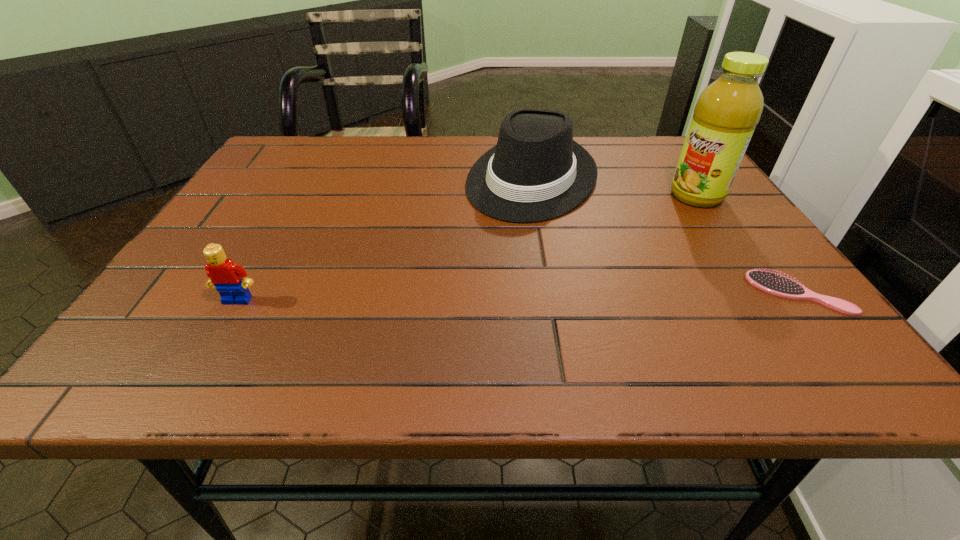
Locate an element on the screen. free space between the Lego and the tallest object is located at coordinates (468, 248).

The height and width of the screenshot is (540, 960). I want to click on empty space that is in between the shortest object and the leftmost object, so click(518, 296).

Where is `vacant area that lies between the tallest object and the hairbrush`? vacant area that lies between the tallest object and the hairbrush is located at coordinates (748, 244).

Where is `vacant point located between the third shortest object and the second shortest object`? vacant point located between the third shortest object and the second shortest object is located at coordinates (385, 239).

Locate an element on the screen. Image resolution: width=960 pixels, height=540 pixels. free space between the Lego and the fruit juice is located at coordinates (468, 248).

Find the location of a particular element. This screenshot has width=960, height=540. free space between the shortest object and the third shortest object is located at coordinates (665, 236).

The width and height of the screenshot is (960, 540). Identify the location of object identified as the closest to the shortest object. (725, 116).

Choose which object is the second nearest neighbor to the fruit juice. Please provide its 2D coordinates. Your answer should be formatted as a tuple, i.e. [(x, y)], where the tuple contains the x and y coordinates of a point satisfying the conditions above.

[(773, 283)]

Where is `vacant space that satisfies the following two spatial constraints: 1. on the front side of the fruit juice; 2. on the left side of the shortest object`? This screenshot has width=960, height=540. vacant space that satisfies the following two spatial constraints: 1. on the front side of the fruit juice; 2. on the left side of the shortest object is located at coordinates (762, 293).